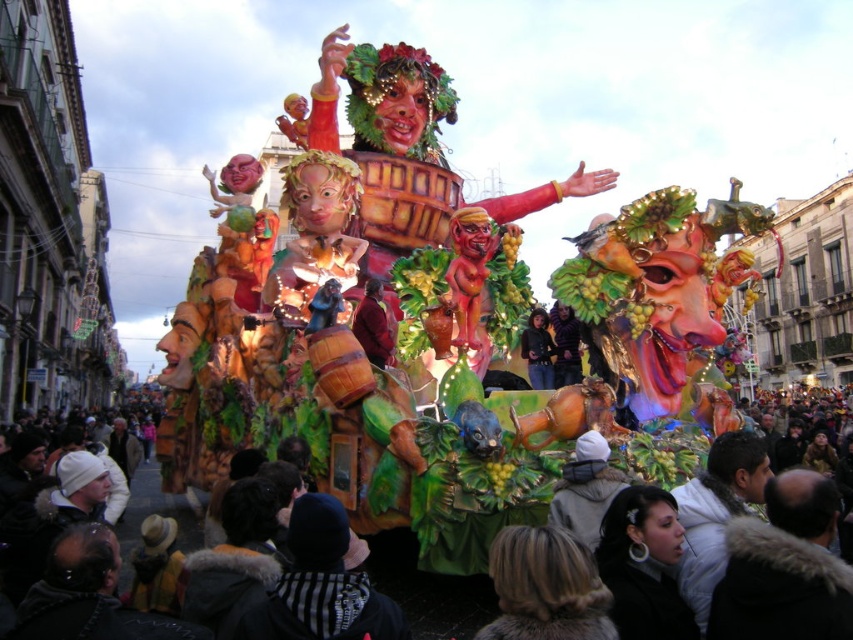
You are a photographer at the carnival parade. You want to take a photo of the float with the matte brown coat at center. Where should you position yourself to capture the best shot?

The best position to capture the matte brown coat at center is directly in front of it, at point (374,324), to ensure it is centered and prominent in the photo.

You are a spectator at the carnival parade and notice two items on the central figure of the float. One is the matte brown coat at center and the other is the matte black jacket at center. Which one is visible above the other?

The matte brown coat at center is positioned over the matte black jacket at center, so the matte brown coat at center is visible above the matte black jacket at center.

You are a photographer standing at the front of the float and want to capture the dark brown fur coat at lower center in your shot. Based on its position, where should you aim your camera?

The dark brown fur coat at lower center is located at coordinates point 0.920 on the x axis and 0.503 on the y axis, so you should aim your camera towards the lower right side of the float to capture it.